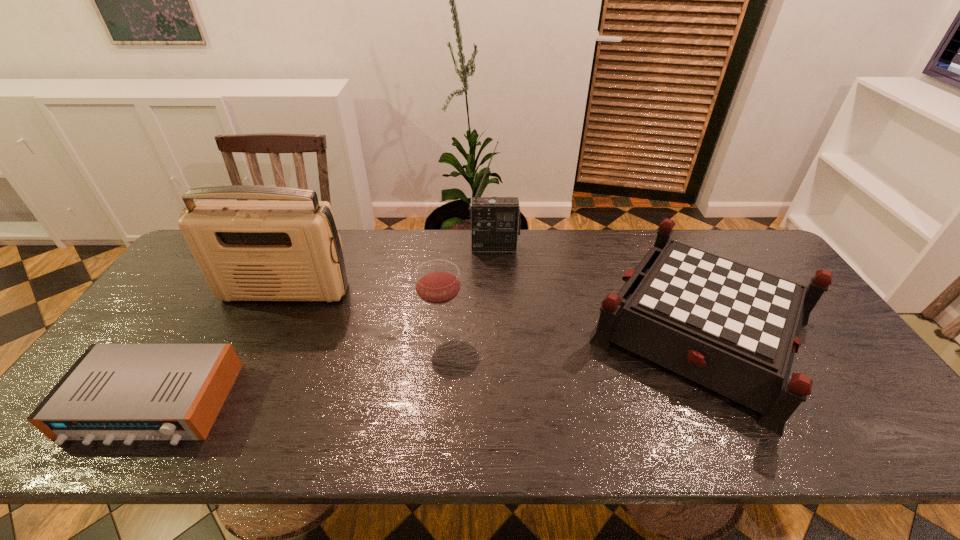
The image size is (960, 540). In order to click on blank space located 0.120m on the front-facing side of the second nearest radio receiver in this screenshot , I will do `click(263, 337)`.

At what (x,y) coordinates should I click in order to perform the action: click on free location located on the back of the third shortest object. Please return your answer as a coordinate pair (x, y). The width and height of the screenshot is (960, 540). Looking at the image, I should click on (447, 264).

Image resolution: width=960 pixels, height=540 pixels. I want to click on vacant region located on the left of the rightmost object, so click(x=545, y=328).

The width and height of the screenshot is (960, 540). Find the location of `radio receiver present at the far edge`. radio receiver present at the far edge is located at coordinates (495, 221).

In order to click on checkerboard at the far edge in this screenshot , I will do `click(734, 329)`.

Where is `checkerboard that is at the near edge`? Image resolution: width=960 pixels, height=540 pixels. checkerboard that is at the near edge is located at coordinates (734, 329).

What are the coordinates of `radio receiver present at the near edge` in the screenshot? It's located at (128, 392).

Where is `object that is at the left edge`? The image size is (960, 540). object that is at the left edge is located at coordinates (128, 392).

Locate an element on the screen. The image size is (960, 540). object that is at the right edge is located at coordinates (734, 329).

Where is `object present at the near left corner`? object present at the near left corner is located at coordinates (128, 392).